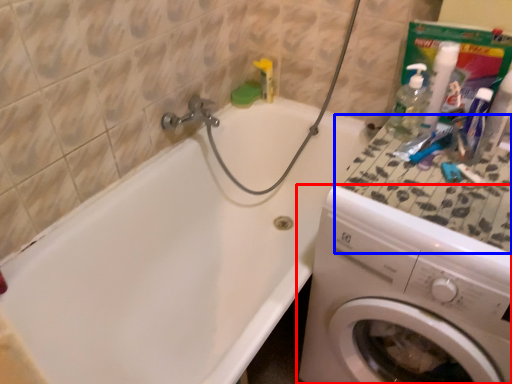
Question: Among these objects, which one is nearest to the camera, washing machine (highlighted by a red box) or counter top (highlighted by a blue box)?

Choices:
 (A) washing machine
 (B) counter top

Answer: (A)